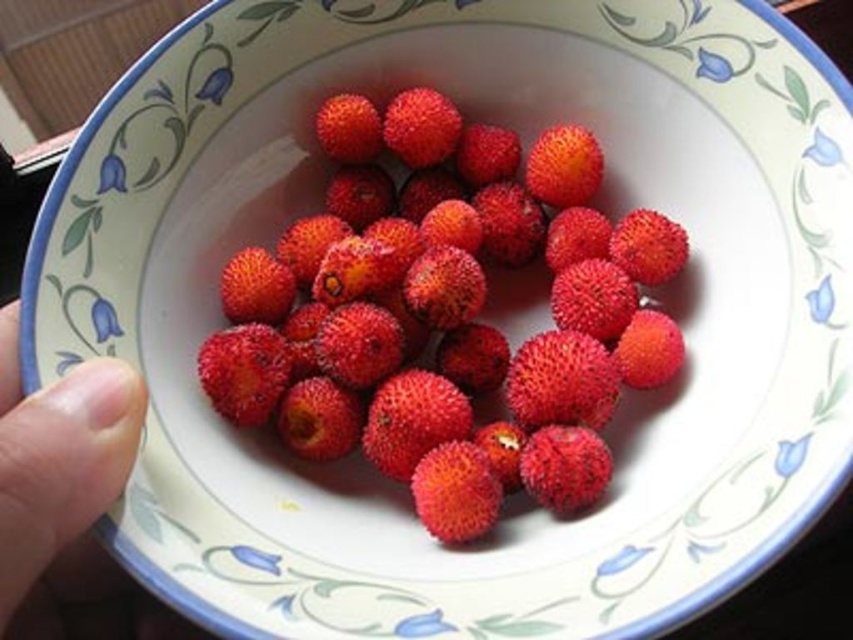
Is spongy red berries at center in front of smooth skin finger at lower left?

That is False.

Which of these two, spongy red berries at center or smooth skin finger at lower left, stands taller?

spongy red berries at center is taller.

Who is more forward, (643, 371) or (119, 360)?

Positioned in front is point (119, 360).

This screenshot has width=853, height=640. What are the coordinates of `spongy red berries at center` in the screenshot? It's located at (447, 314).